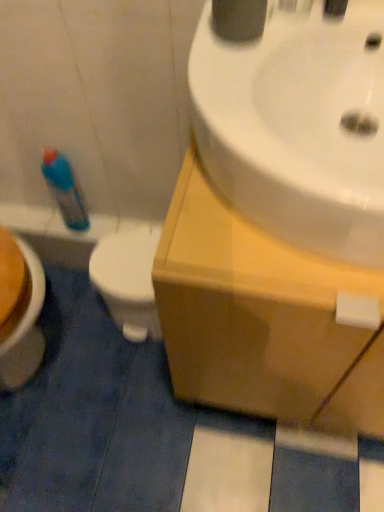
Question: From the image's perspective, is white glossy sink at upper right located above or below wooden cabinet at upper right?

Choices:
 (A) above
 (B) below

Answer: (A)

Question: From a real-world perspective, is white glossy sink at upper right positioned above or below wooden cabinet at upper right?

Choices:
 (A) below
 (B) above

Answer: (B)

Question: Which object is the closest to the blue plastic bottle at left?

Choices:
 (A) white glossy toilet at lower left
 (B) wooden cabinet at upper right
 (C) white glossy sink at upper right
 (D) blue plastic spray bottle at left

Answer: (D)

Question: Which object is positioned farthest from the blue plastic bottle at left?

Choices:
 (A) wooden cabinet at upper right
 (B) white glossy sink at upper right
 (C) white glossy toilet at lower left
 (D) blue plastic spray bottle at left

Answer: (B)